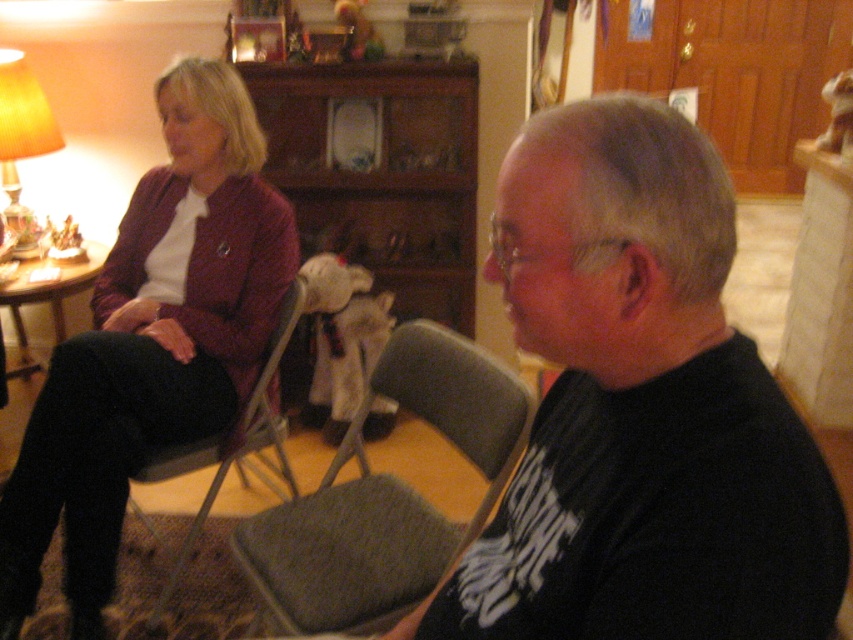
You are standing at the point with coordinates point (83,621) and want to walk to the point with coordinates point (315,557). Which direction should you move in?

You should move forward because point (83,621) is behind point (315,557), so moving forward from point (83,621) will take you towards point (315,557).

You are organizing a small event and need to place a decorative item next to the matte yellow lampshade at left. Considering the space occupied by the matte burgundy sweater at left, which is wider than the lampshade, can you fit a small vase there?

The matte burgundy sweater at left is wider than the matte yellow lampshade at left, so there might not be enough space to place a small vase next to the matte yellow lampshade at left due to the sweater occupying more width.

You are a photographer setting up for a portrait session. You need to position a light source to the right of the gray fabric chair at center to highlight the subject sitting there. However, there is a matte burgundy sweater at left in the scene. Will the light source placement interfere with the sweater?

The matte burgundy sweater at left is to the left of the gray fabric chair at center. Since the light source is placed to the right of the gray fabric chair at center, it will not interfere with the sweater as they are positioned on opposite sides.